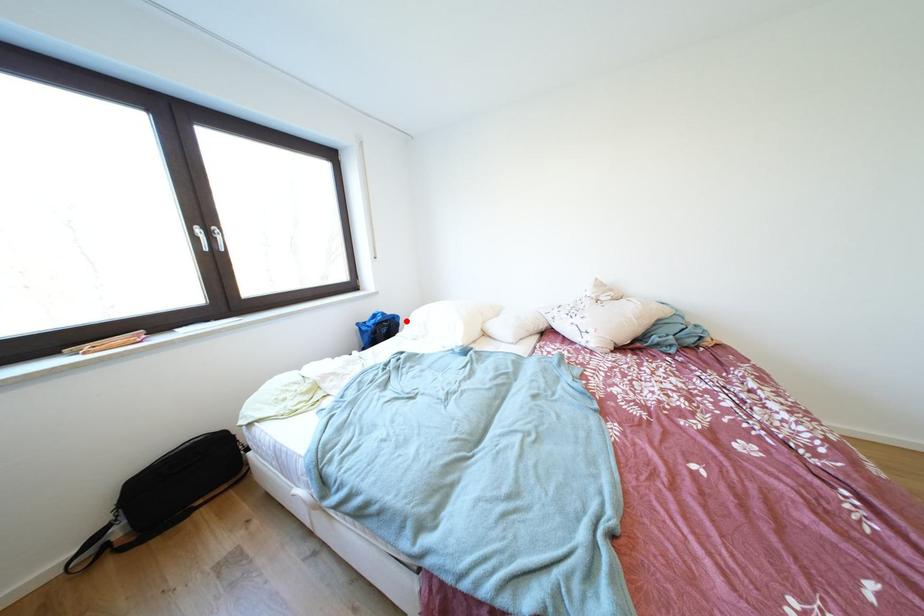
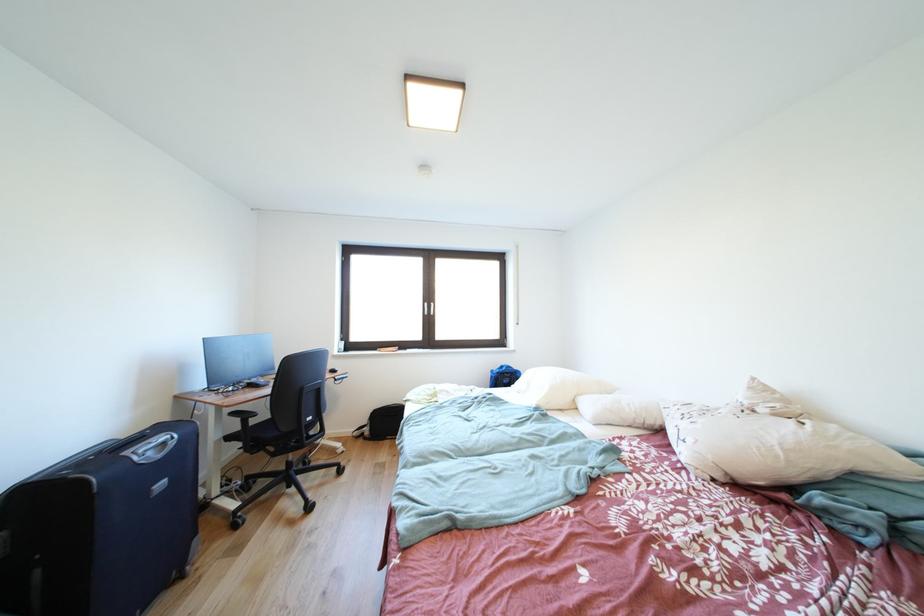
Where in the second image is the point corresponding to the highlighted location from the first image?

(528, 377)